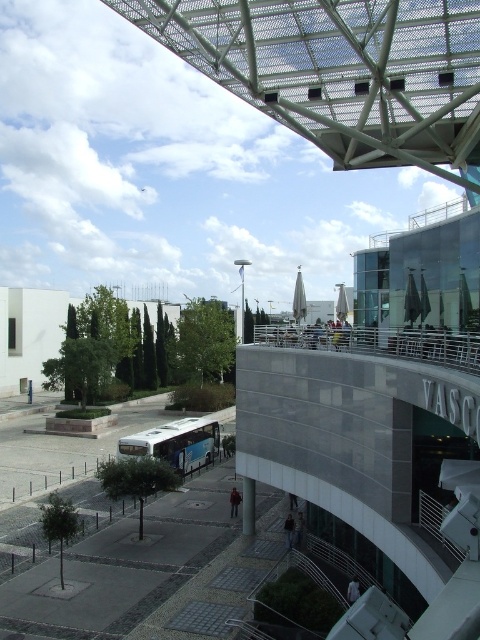
Question: Among these objects, which one is nearest to the camera?

Choices:
 (A) blue metallic bus at center
 (B) gray concrete pillar at lower center

Answer: (B)

Question: Is blue metallic bus at center to the right of gray concrete pillar at lower center from the viewer's perspective?

Choices:
 (A) no
 (B) yes

Answer: (A)

Question: Which object is farther from the camera taking this photo?

Choices:
 (A) blue metallic bus at center
 (B) gray concrete pillar at lower center

Answer: (A)

Question: Does blue metallic bus at center appear under gray concrete pillar at lower center?

Choices:
 (A) no
 (B) yes

Answer: (A)

Question: Does blue metallic bus at center have a larger size compared to gray concrete pillar at lower center?

Choices:
 (A) yes
 (B) no

Answer: (A)

Question: Among these objects, which one is nearest to the camera?

Choices:
 (A) gray concrete pillar at lower center
 (B) blue metallic bus at center

Answer: (A)